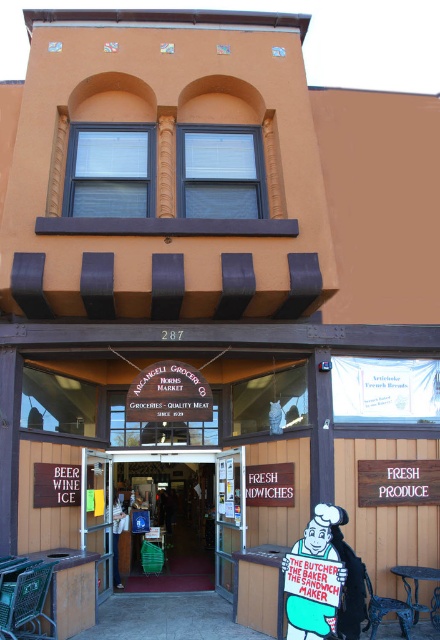
You are standing in front of the Arcangeli Grocery Co. and notice two items at the center of the entrance area. The wooden signboard at center and the cartoonish painted figure at center. Which one is taller?

The wooden signboard at center is not as tall as the cartoonish painted figure at center, so the cartoonish painted figure at center is taller.

You are standing in front of the entrance of Arcangeli Grocery Co. and see both the green plastic basket at center and the cartoonish painted figure at center. Which object is closer to you?

The green plastic basket at center is closer to you because it is further to the viewer than the cartoonish painted figure at center.

In the scene shown: You are a customer entering Arcangeli Grocery Co. and see a green plastic basket at center and a cartoonish painted figure at center. Which object is closer to the entrance?

The green plastic basket at center is closer to the entrance than the cartoonish painted figure at center because it has a smaller size, indicating it is placed nearer to the viewer.